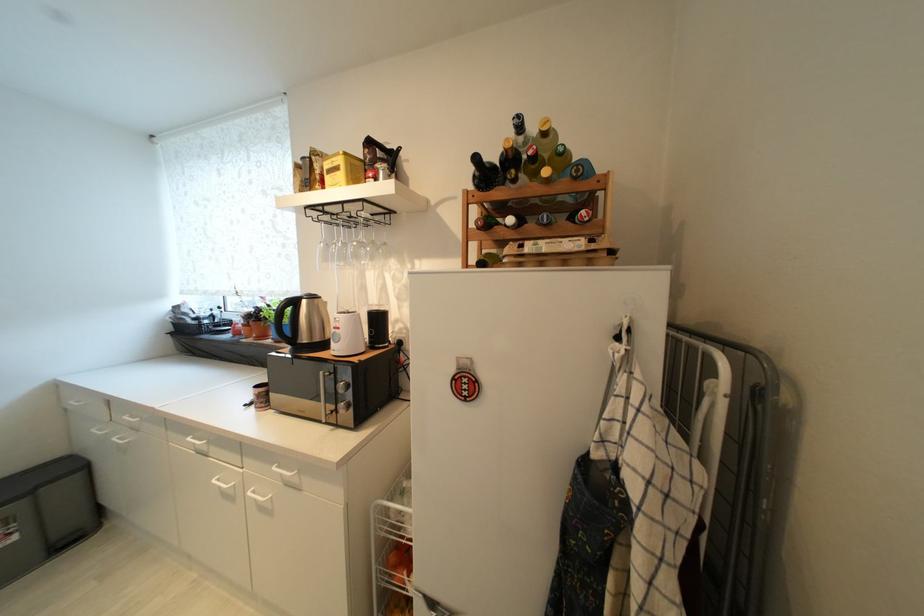
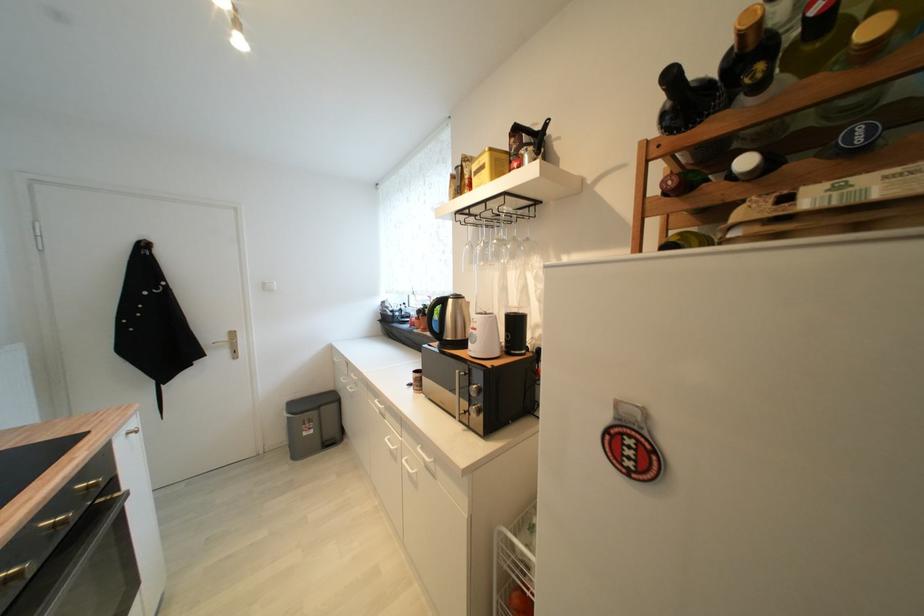
The point at (383, 321) is marked in the first image. Where is the corresponding point in the second image?

(521, 325)